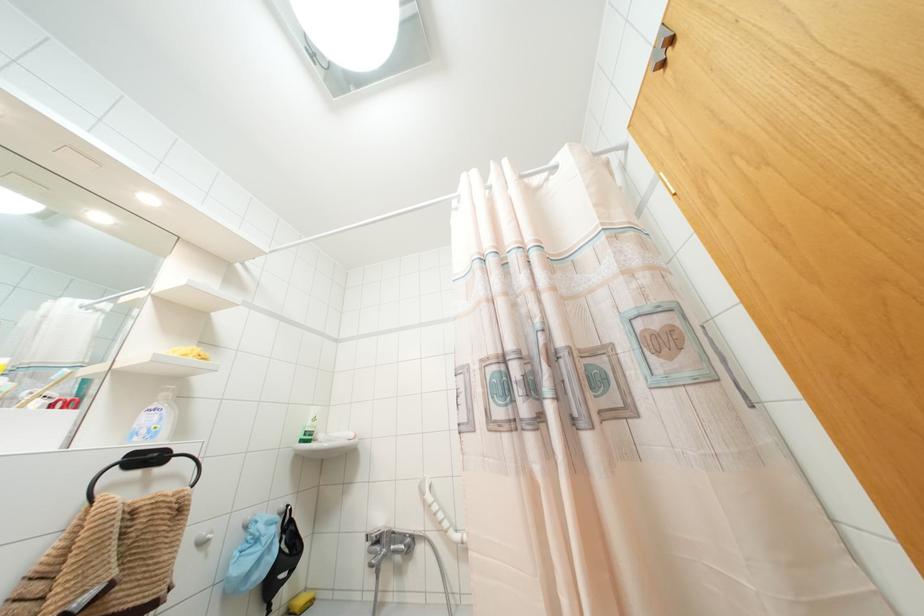
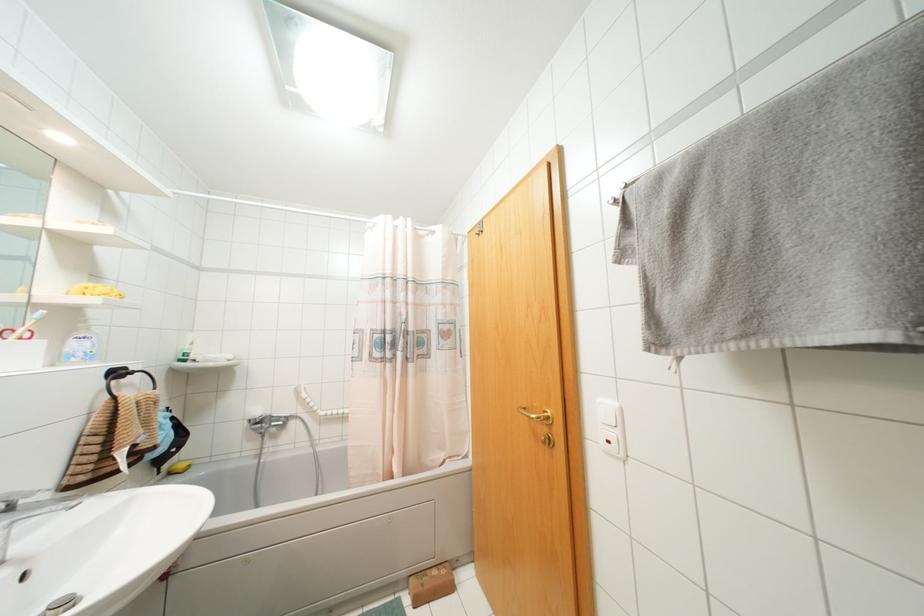
Where in the second image is the point corresponding to point (381, 521) from the first image?

(258, 411)